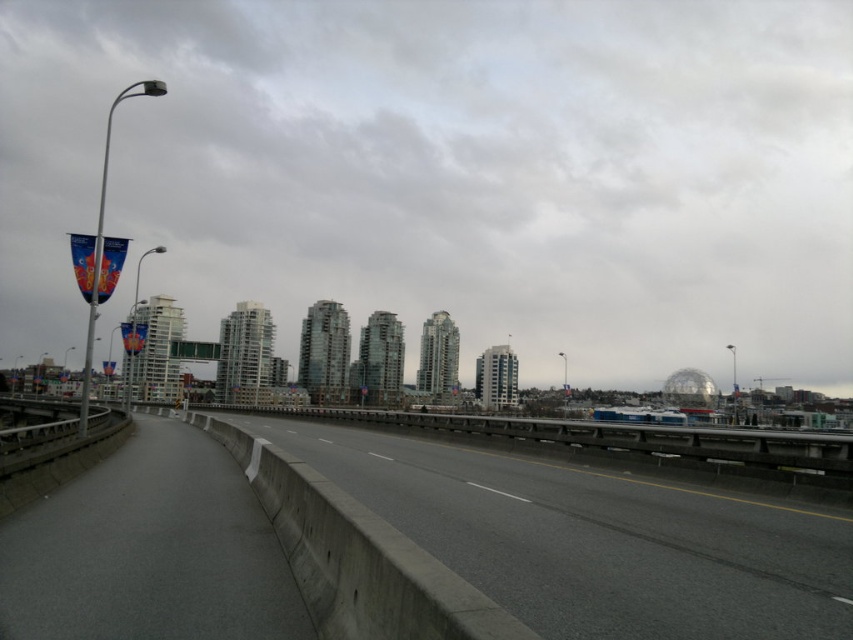
You are driving a car and want to see the transparent glass buildings at center while avoiding the gray concrete highway at center. Is this possible from your current position?

The transparent glass buildings at center are closer to you than the gray concrete highway at center, so you can see them without obstruction from the highway.

You are a driver approaching the transparent glass buildings at center and the gray concrete highway at center. Which one is located to the right side of the other?

The transparent glass buildings at center is positioned on the right side of gray concrete highway at center.